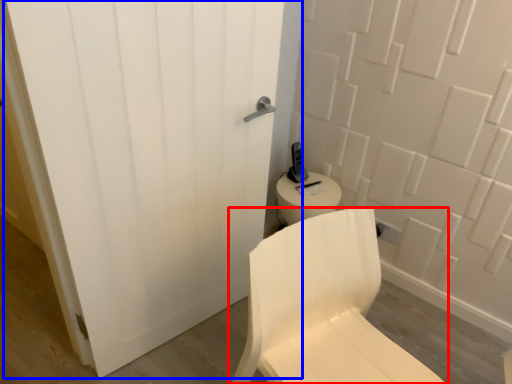
Question: Among these objects, which one is nearest to the camera, chair (highlighted by a red box) or door (highlighted by a blue box)?

Choices:
 (A) chair
 (B) door

Answer: (A)